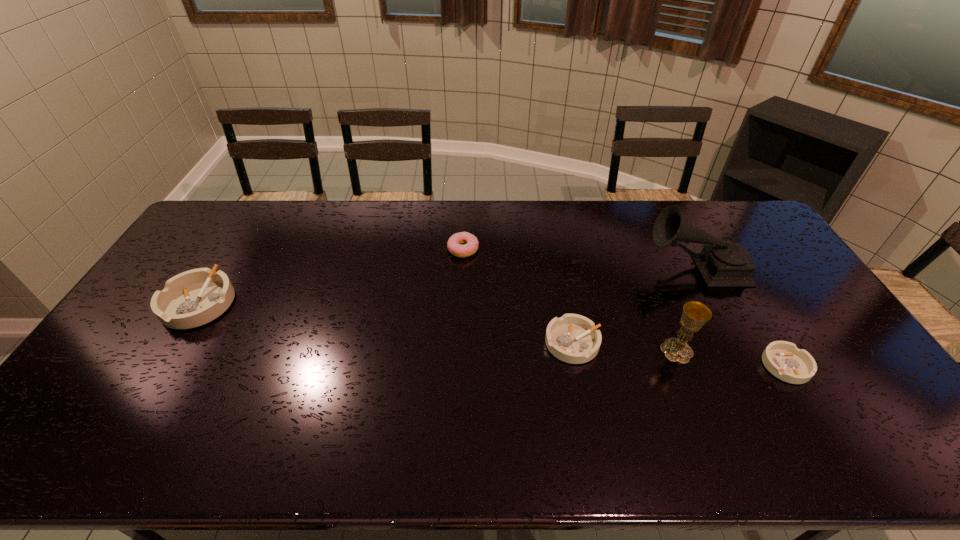
Where is `vacant region at the far edge of the desktop`? The height and width of the screenshot is (540, 960). vacant region at the far edge of the desktop is located at coordinates (413, 237).

You are a GUI agent. You are given a task and a screenshot of the screen. Output one action in this format:
    pyautogui.click(x=<x>, y=<y>)
    Task: Click on the vacant region at the near edge of the desktop
    The width and height of the screenshot is (960, 540).
    Given the screenshot: What is the action you would take?
    pyautogui.click(x=818, y=400)

This screenshot has height=540, width=960. In the image, there is a desktop. In order to click on free space at the left edge in this screenshot , I will do `click(209, 268)`.

Where is `vacant space at the near left corner`? The height and width of the screenshot is (540, 960). vacant space at the near left corner is located at coordinates (122, 402).

In the image, there is a desktop. Identify the location of vacant space at the far right corner. tap(752, 226).

Where is `free space between the tallest object and the fifth object from right to left`? free space between the tallest object and the fifth object from right to left is located at coordinates (579, 259).

Find the location of a particular element. Image resolution: width=960 pixels, height=540 pixels. free spot between the tallest object and the rightmost ashtray is located at coordinates (740, 316).

You are a GUI agent. You are given a task and a screenshot of the screen. Output one action in this format:
    pyautogui.click(x=<x>, y=<y>)
    Task: Click on the free space between the second ashtray from right to left and the second object from left to right
    This screenshot has height=540, width=960.
    Given the screenshot: What is the action you would take?
    pyautogui.click(x=518, y=296)

Find the location of a particular element. free spot between the tallest ashtray and the rightmost ashtray is located at coordinates (492, 334).

Find the location of `unoccupied area between the doughnut and the fourth shortest object`. unoccupied area between the doughnut and the fourth shortest object is located at coordinates (331, 276).